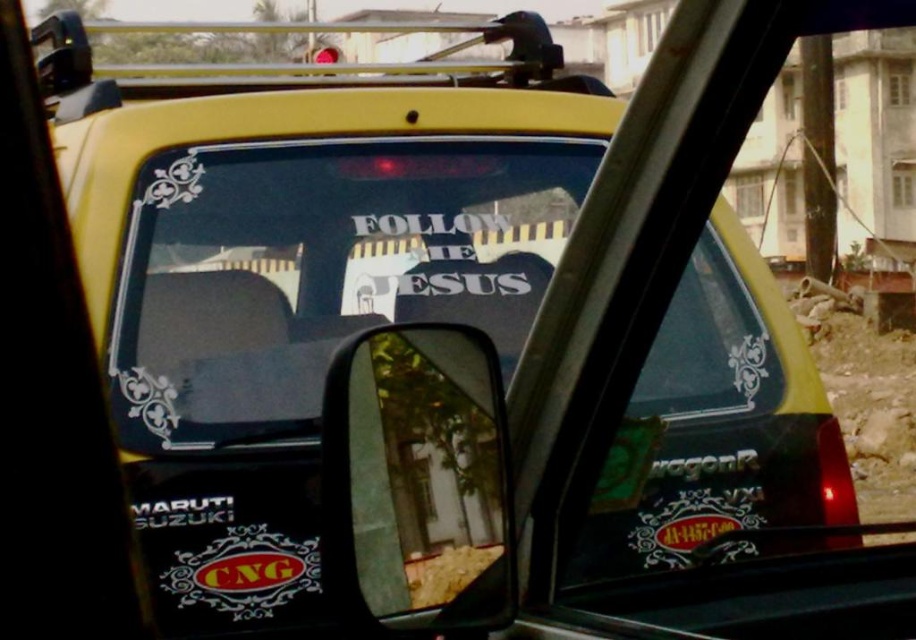
Between transparent vinyl sticker at center and clear plastic mirror at center, which one is positioned lower?

clear plastic mirror at center is lower down.

Which is in front, point (144, 189) or point (482, 380)?

Point (482, 380) is more forward.

Measure the distance between transparent vinyl sticker at center and camera.

The distance of transparent vinyl sticker at center from camera is 1.99 meters.

This screenshot has width=916, height=640. I want to click on transparent vinyl sticker at center, so click(320, 268).